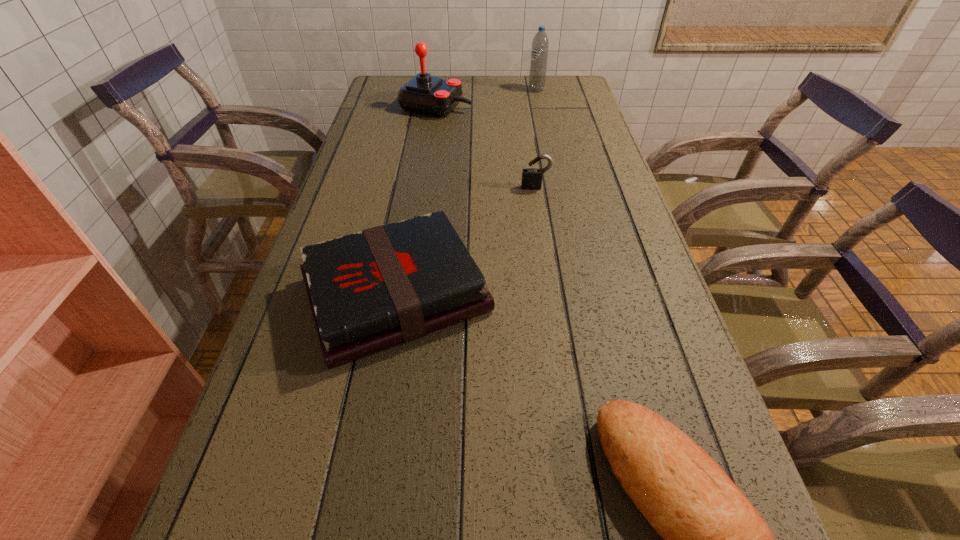
This screenshot has width=960, height=540. I want to click on the farthest object, so click(539, 53).

Image resolution: width=960 pixels, height=540 pixels. Find the location of `joystick`. joystick is located at coordinates (425, 94).

The height and width of the screenshot is (540, 960). I want to click on the third farthest object, so click(x=531, y=177).

You are a GUI agent. You are given a task and a screenshot of the screen. Output one action in this format:
    pyautogui.click(x=<x>, y=<y>)
    Task: Click on the hardback book
    This screenshot has height=540, width=960.
    Given the screenshot: What is the action you would take?
    pyautogui.click(x=372, y=290)

The height and width of the screenshot is (540, 960). I want to click on free region located on the left of the farthest object, so (427, 90).

This screenshot has width=960, height=540. I want to click on free space located on the left of the joystick, so click(x=382, y=106).

This screenshot has height=540, width=960. I want to click on free space located with the keyhole on the front of the padlock, so click(548, 273).

Find the location of a particular element. vacant space positioned 0.370m on the back of the second nearest object is located at coordinates (421, 154).

Where is `water bottle that is at the far edge`? The height and width of the screenshot is (540, 960). water bottle that is at the far edge is located at coordinates (539, 53).

This screenshot has height=540, width=960. I want to click on joystick positioned at the far edge, so click(425, 94).